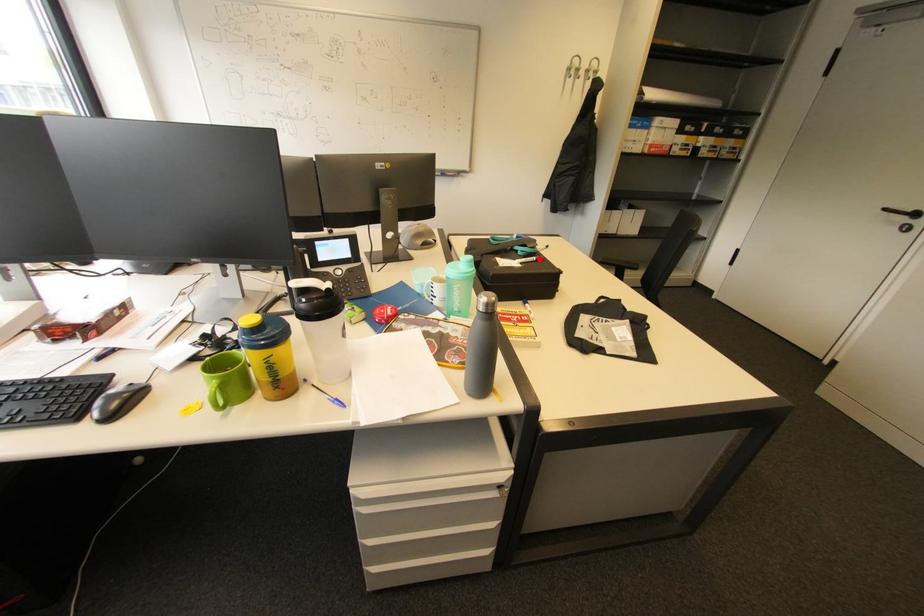
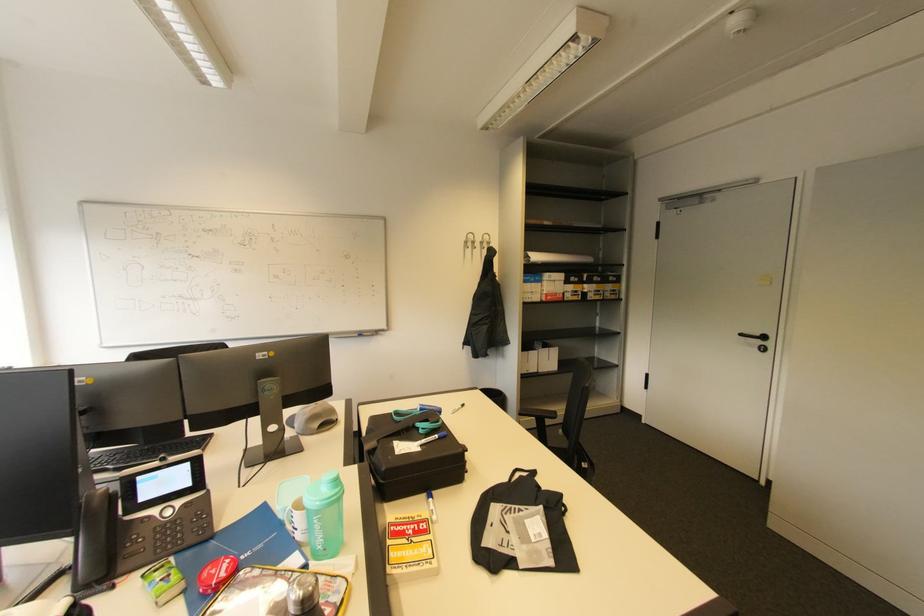
Locate, in the second image, the point that corresponds to the highlighted location in the first image.

(441, 437)